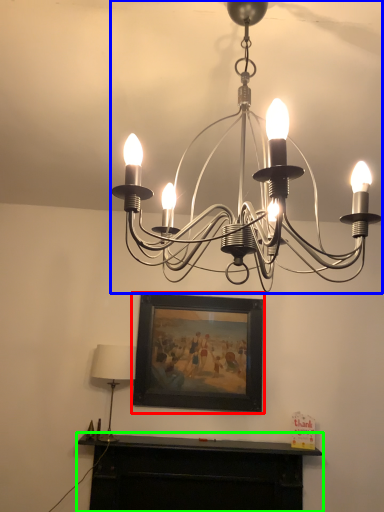
Question: Which object is positioned farthest from picture frame (highlighted by a red box)? Select from lamp (highlighted by a blue box) and furniture (highlighted by a green box).

Choices:
 (A) lamp
 (B) furniture

Answer: (A)